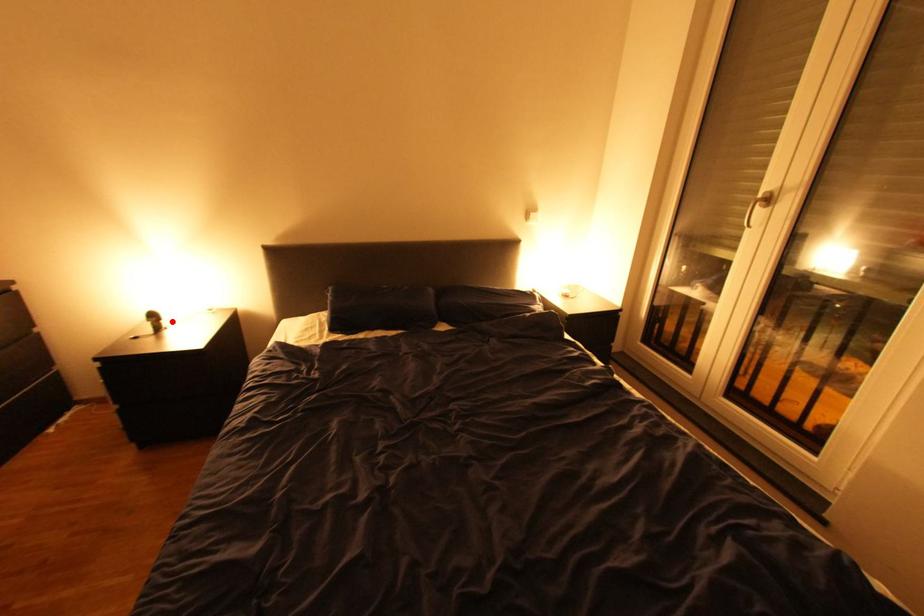
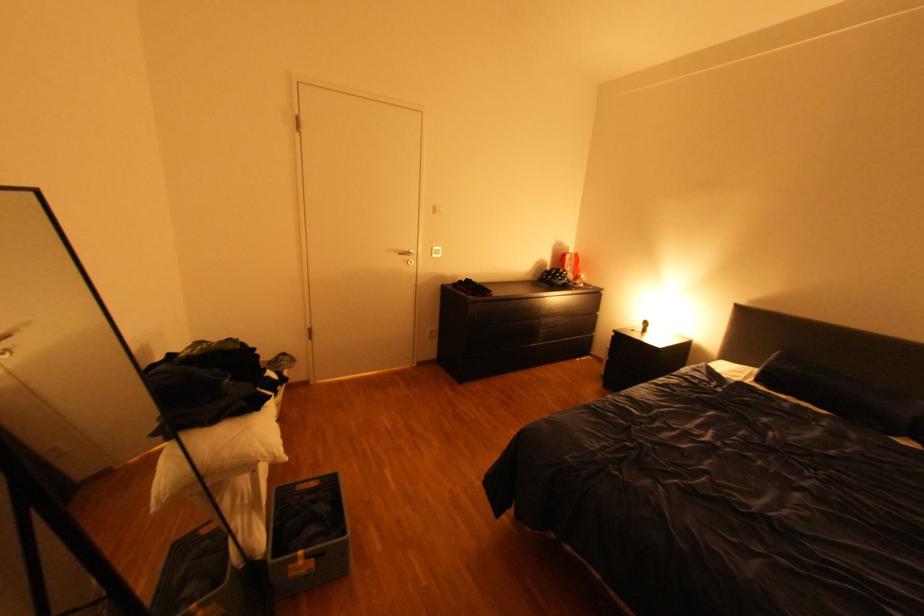
Locate, in the second image, the point that corresponds to the highlighted location in the first image.

(659, 328)